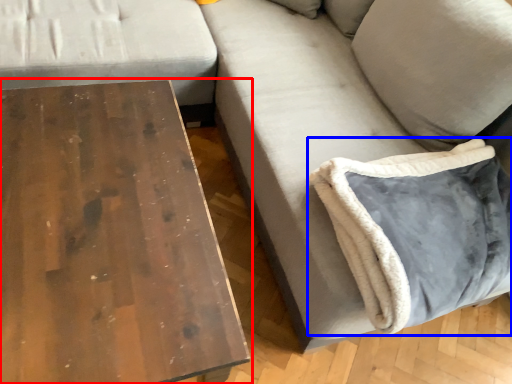
Question: Among these objects, which one is farthest to the camera, table (highlighted by a red box) or pillow (highlighted by a blue box)?

Choices:
 (A) table
 (B) pillow

Answer: (B)